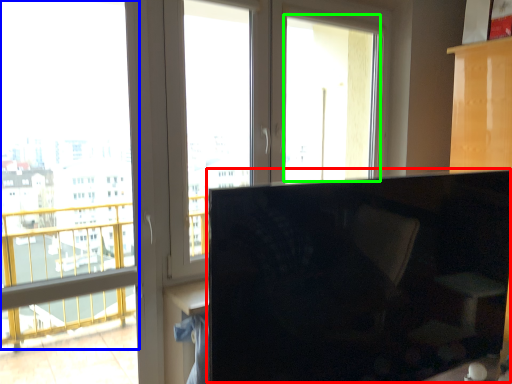
Question: Estimate the real-world distances between objects in this image. Which object is closer to computer monitor (highlighted by a red box), window screen (highlighted by a blue box) or window screen (highlighted by a green box)?

Choices:
 (A) window screen
 (B) window screen

Answer: (A)